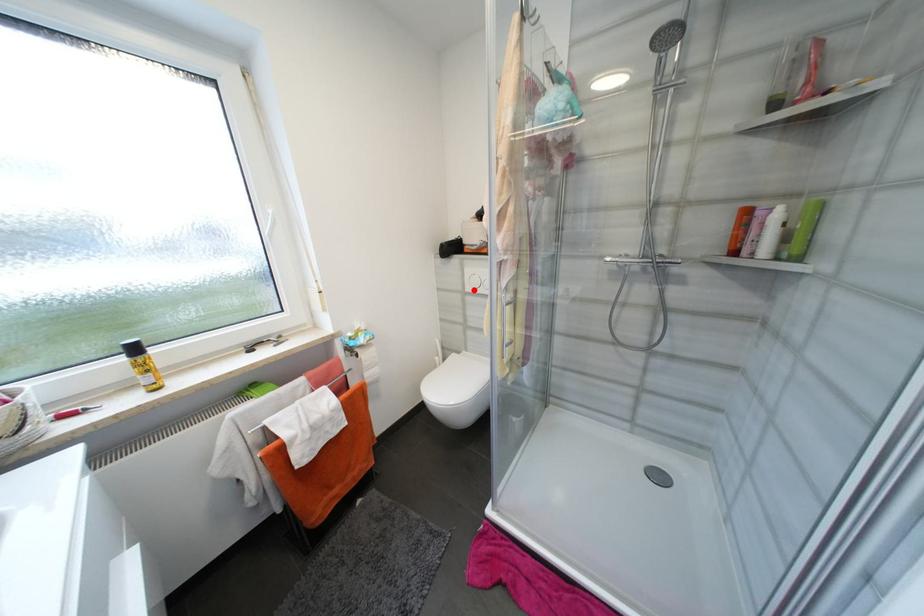
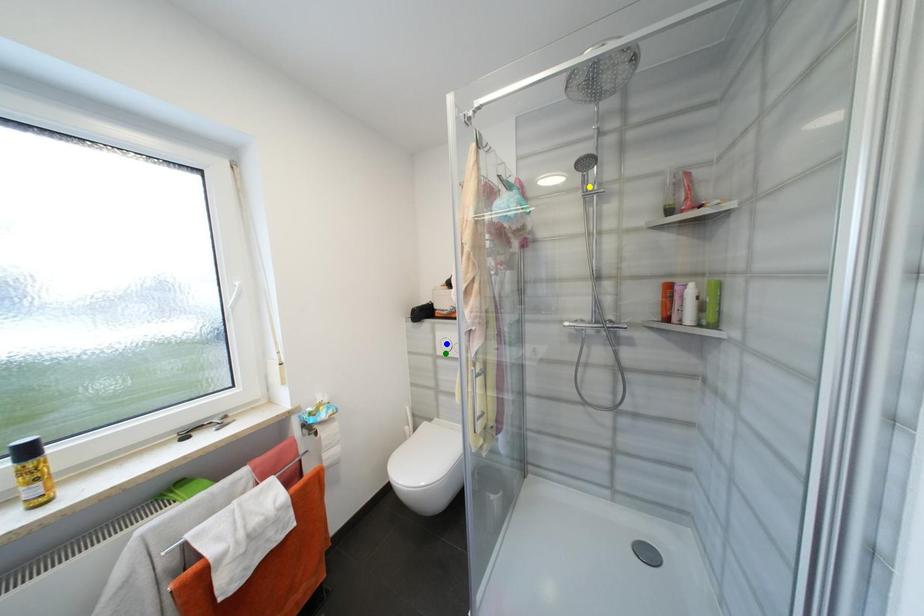
Question: I am providing you with two images of the same scene from different viewpoints. A red point is marked on the first image. You are given multiple points on the second image. Can you choose the point in image 2 that corresponds to the point in image 1?

Choices:
 (A) green point
 (B) blue point
 (C) yellow point

Answer: (A)